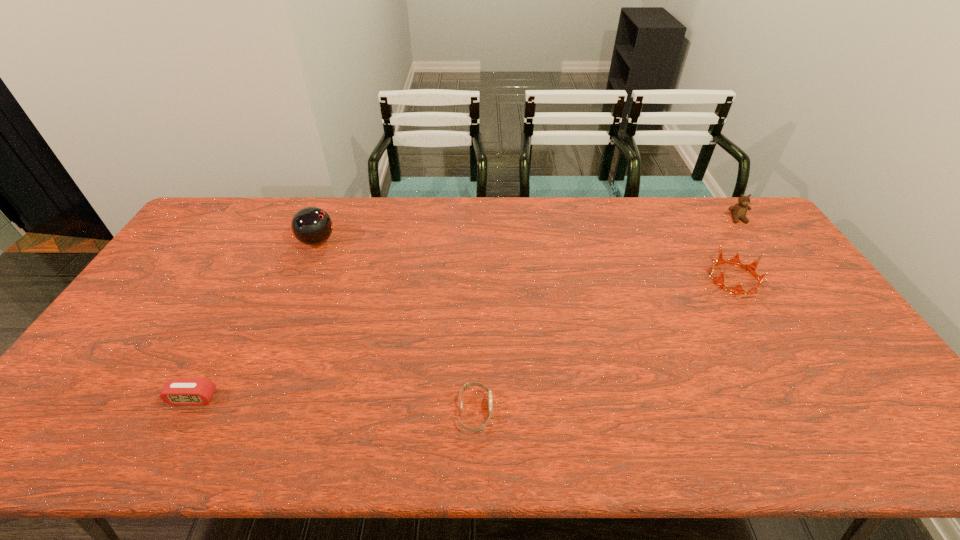
The width and height of the screenshot is (960, 540). In order to click on bowling ball in this screenshot , I will do `click(312, 226)`.

The image size is (960, 540). What are the coordinates of `the tallest object` in the screenshot? It's located at (312, 226).

Locate an element on the screen. the rightmost object is located at coordinates (738, 211).

At what (x,y) coordinates should I click in order to perform the action: click on teddy bear. Please return your answer as a coordinate pair (x, y). Looking at the image, I should click on (738, 211).

Locate an element on the screen. The height and width of the screenshot is (540, 960). the third shortest object is located at coordinates (751, 268).

Locate an element on the screen. This screenshot has height=540, width=960. the third nearest object is located at coordinates click(751, 268).

Find the location of a particular element. the leftmost object is located at coordinates (178, 391).

You are a GUI agent. You are given a task and a screenshot of the screen. Output one action in this format:
    pyautogui.click(x=<x>, y=<y>)
    Task: Click on the watch
    
    Given the screenshot: What is the action you would take?
    pyautogui.click(x=467, y=385)

You are a GUI agent. You are given a task and a screenshot of the screen. Output one action in this format:
    pyautogui.click(x=<x>, y=<y>)
    Task: Click on the free space located on the surface of the tallest object near the finger holes
    This screenshot has width=960, height=540.
    Given the screenshot: What is the action you would take?
    pyautogui.click(x=389, y=241)

You are a GUI agent. You are given a task and a screenshot of the screen. Output one action in this format:
    pyautogui.click(x=<x>, y=<y>)
    Task: Click on the free space located at the face of the farthest object
    The width and height of the screenshot is (960, 540).
    Given the screenshot: What is the action you would take?
    pyautogui.click(x=781, y=282)